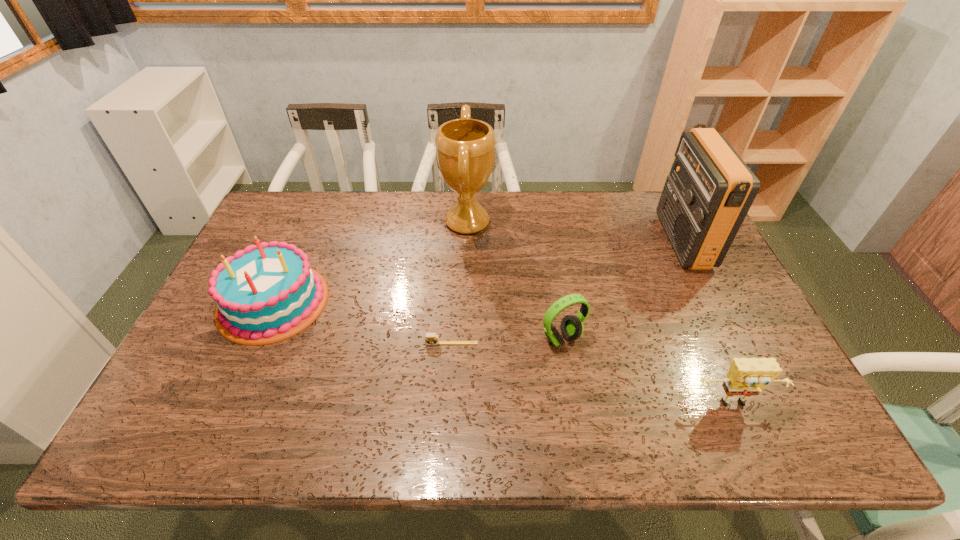
Where is `free space located on the front-facing side of the radio receiver`? free space located on the front-facing side of the radio receiver is located at coordinates (631, 241).

Locate an element on the screen. The height and width of the screenshot is (540, 960). free space located on the back of the leftmost object is located at coordinates (314, 210).

Where is `free space located on the left of the headset`? The image size is (960, 540). free space located on the left of the headset is located at coordinates (393, 339).

Locate an element on the screen. This screenshot has width=960, height=540. vacant area located 0.140m at the front of the shortest object with the tape extended is located at coordinates (448, 394).

What are the coordinates of `award situated at the far edge` in the screenshot? It's located at (465, 148).

At what (x,y) coordinates should I click in order to perform the action: click on radio receiver present at the far edge. Please return your answer as a coordinate pair (x, y). The image size is (960, 540). Looking at the image, I should click on (710, 189).

You are a GUI agent. You are given a task and a screenshot of the screen. Output one action in this format:
    pyautogui.click(x=<x>, y=<y>)
    Task: Click on the object located in the near edge section of the desktop
    Image resolution: width=960 pixels, height=540 pixels.
    Given the screenshot: What is the action you would take?
    pyautogui.click(x=747, y=376)

The image size is (960, 540). In order to click on object positioned at the left edge in this screenshot , I will do `click(266, 293)`.

The height and width of the screenshot is (540, 960). Find the location of `radio receiver situated at the right edge`. radio receiver situated at the right edge is located at coordinates (710, 189).

At what (x,y) coordinates should I click in order to perform the action: click on sponge located in the right edge section of the desktop. Please return your answer as a coordinate pair (x, y). Looking at the image, I should click on (747, 376).